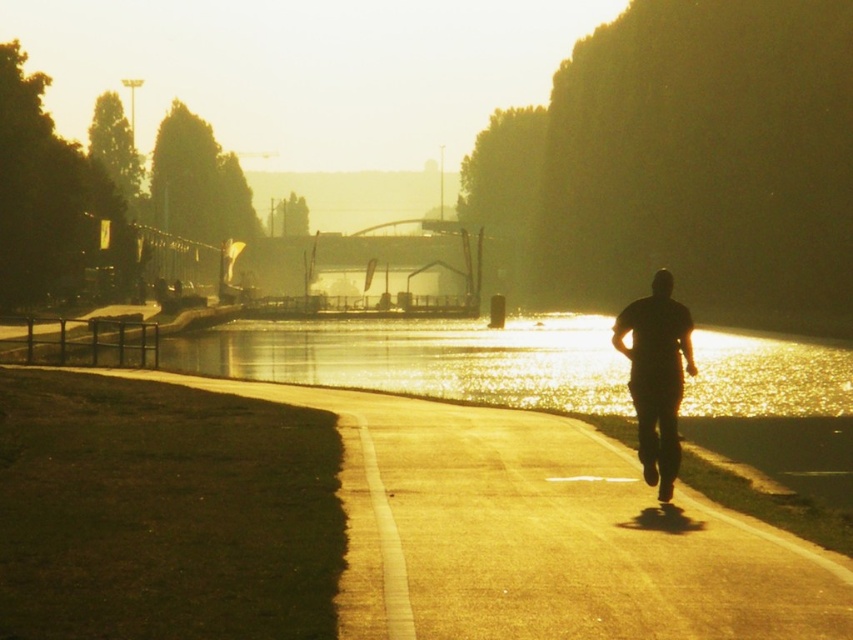
You are standing on the smooth asphalt path at center and want to wave to the black matte man at center. In which direction should you wave your hand to ensure they see it?

The smooth asphalt path at center is to the left of black matte man at center, so you should wave your hand to the right to ensure the black matte man at center sees it.

You are standing at the point closer to the camera between point (315, 406) and point (653, 282). Which point are you standing at?

You are standing at point (315, 406) because it is further to the camera than point (653, 282).